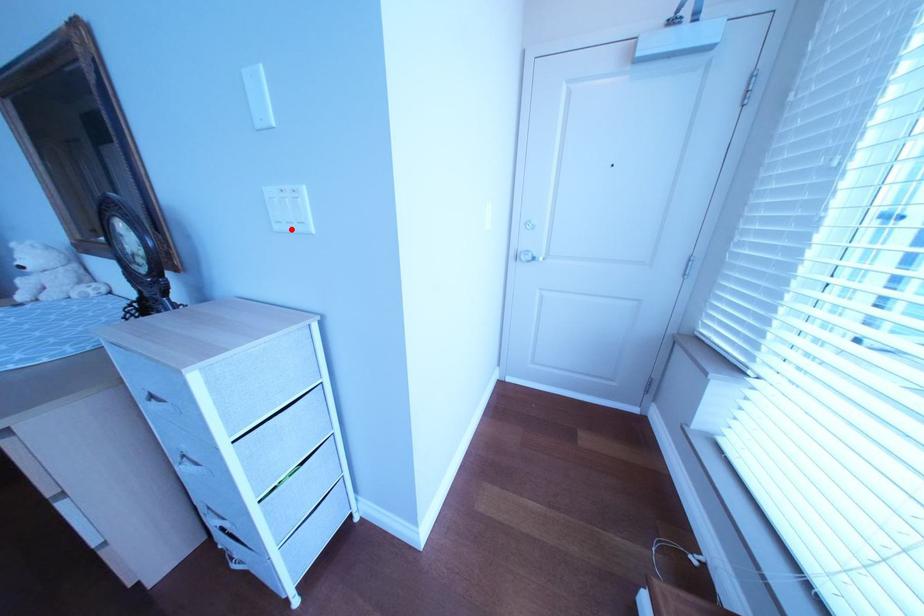
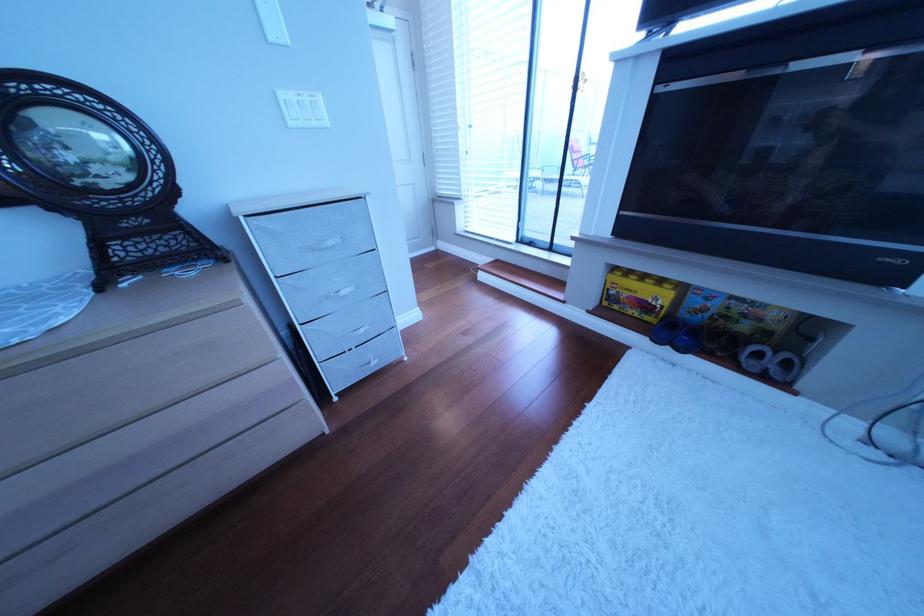
In the second image, find the point that corresponds to the highlighted location in the first image.

(307, 126)